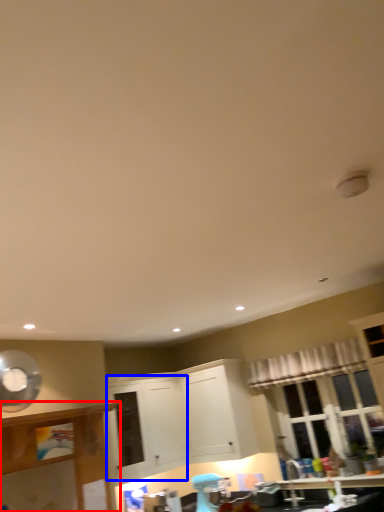
Question: Which point is further to the camera, cabinetry (highlighted by a red box) or cabinetry (highlighted by a blue box)?

Choices:
 (A) cabinetry
 (B) cabinetry

Answer: (B)